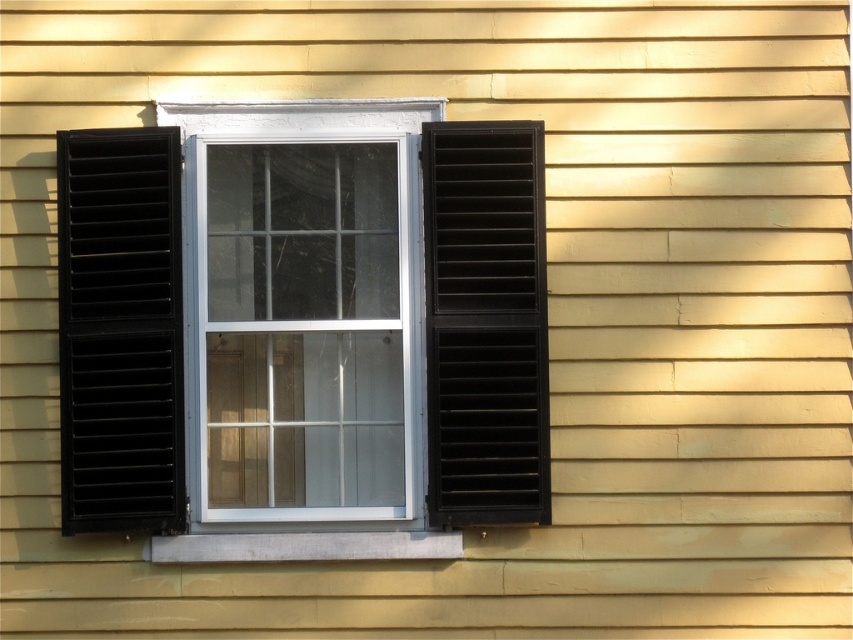
Question: Observing the image, what is the correct spatial positioning of black matte/shiny wood shutter at left in reference to smooth concrete sill at lower center?

Choices:
 (A) right
 (B) left

Answer: (B)

Question: Which of the following is the farthest from the observer?

Choices:
 (A) black matte/shiny wood shutter at left
 (B) matte black shutter at right
 (C) smooth concrete sill at lower center
 (D) white plastic window at center

Answer: (D)

Question: Does white plastic window at center appear on the right side of matte black shutter at right?

Choices:
 (A) no
 (B) yes

Answer: (A)

Question: Can you confirm if white plastic window at center is positioned below black matte/shiny wood shutter at left?

Choices:
 (A) yes
 (B) no

Answer: (B)

Question: Which object is positioned farthest from the matte black shutter at right?

Choices:
 (A) black matte/shiny wood shutter at left
 (B) smooth concrete sill at lower center

Answer: (A)

Question: Which point is farther to the camera?

Choices:
 (A) white plastic window at center
 (B) smooth concrete sill at lower center
 (C) matte black shutter at right
 (D) black matte/shiny wood shutter at left

Answer: (A)